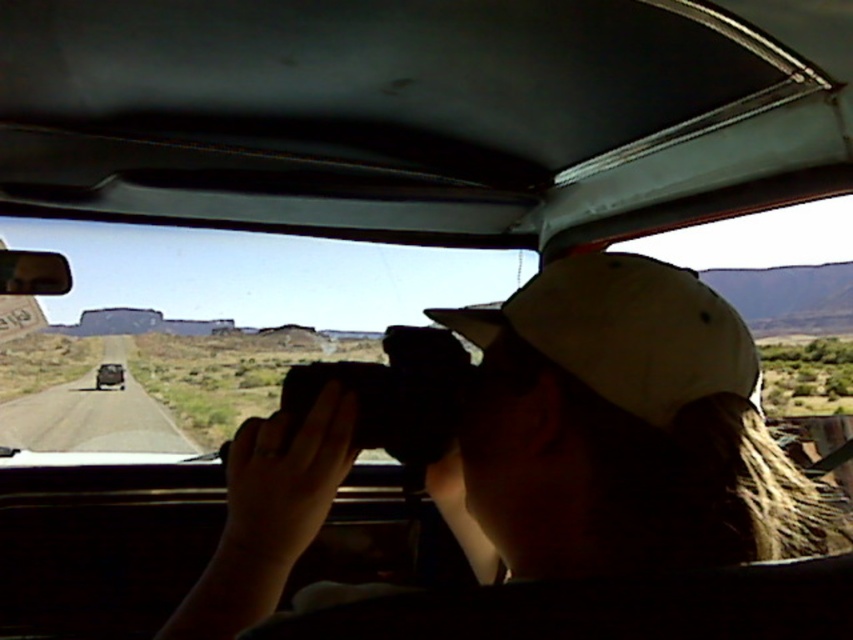
The width and height of the screenshot is (853, 640). What do you see at coordinates (393, 394) in the screenshot?
I see `black matte camera at center` at bounding box center [393, 394].

Where is `black matte camera at center`? black matte camera at center is located at coordinates (393, 394).

Is transparent glass car window at center closer to the viewer compared to black matte camera at center?

That is False.

Does transparent glass car window at center come behind black matte camera at center?

Yes.

Who is more distant from viewer, (184, 234) or (462, 369)?

The point (184, 234) is behind.

At what (x,y) coordinates should I click in order to perform the action: click on transparent glass car window at center. Please return your answer as a coordinate pair (x, y). Looking at the image, I should click on (207, 324).

Does transparent glass car window at center appear on the right side of white matte baseball hat at center?

No, transparent glass car window at center is not to the right of white matte baseball hat at center.

Based on the photo, measure the distance between transparent glass car window at center and camera.

transparent glass car window at center and camera are 8.88 feet apart.

Describe the element at coordinates (207, 324) in the screenshot. The height and width of the screenshot is (640, 853). I see `transparent glass car window at center` at that location.

This screenshot has height=640, width=853. Identify the location of transparent glass car window at center. (207, 324).